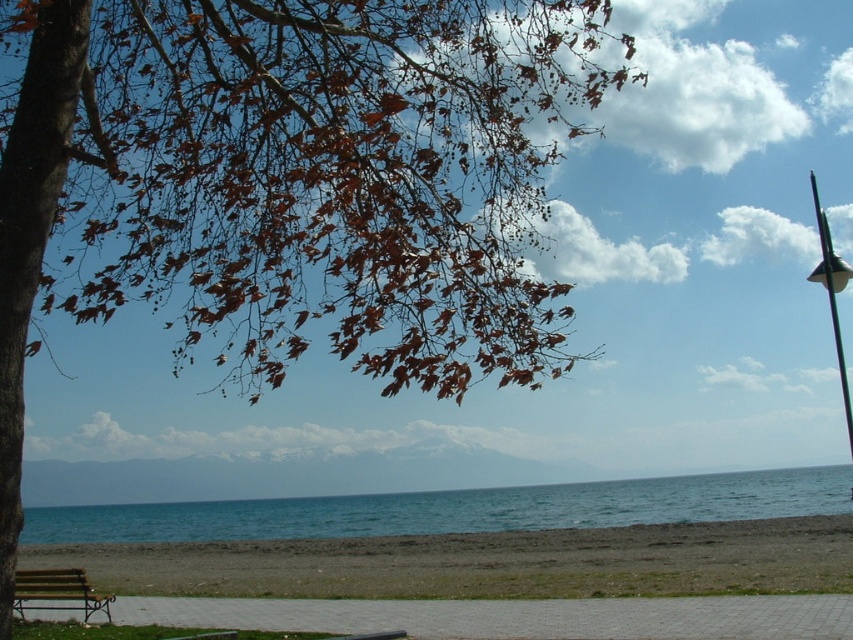
You are a photographer standing on the wooden park bench at lower left, aiming to capture the blue water at center in your shot. Considering the bench is at a lower elevation, how might its position affect the composition of the water in your photo?

The blue water at center is much taller than the wooden park bench at lower left, so positioning yourself on the bench would place the water higher in the frame, potentially making it the dominant element in your photograph.

You are a hiker carrying a heavy backpack and need to rest. You see a wooden park bench at lower left and brown sand at lower left. Which surface would be more stable for resting your backpack?

The wooden park bench at lower left is more stable because it is a solid surface compared to the brown sand at lower left, which might be loose and uneven.

You are standing on the paved walkway and want to walk to the point marked at coordinates (485, 563). According to the scene, will you have to step onto the beach to reach this point?

The point at (485, 563) is located on brown sand at lower left, which is part of the beach area. Since the paved walkway is separate from the beach, you will need to step onto the beach to reach the point.